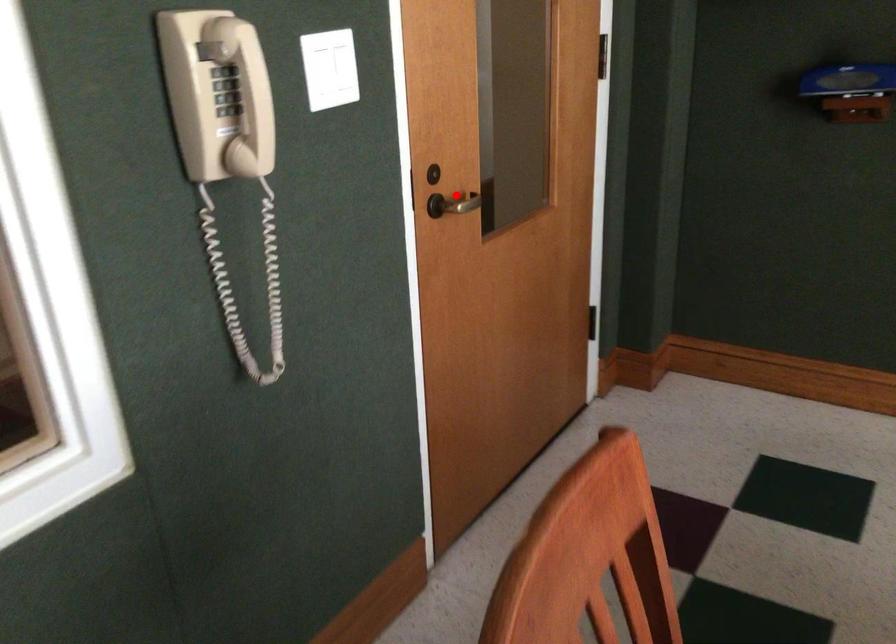
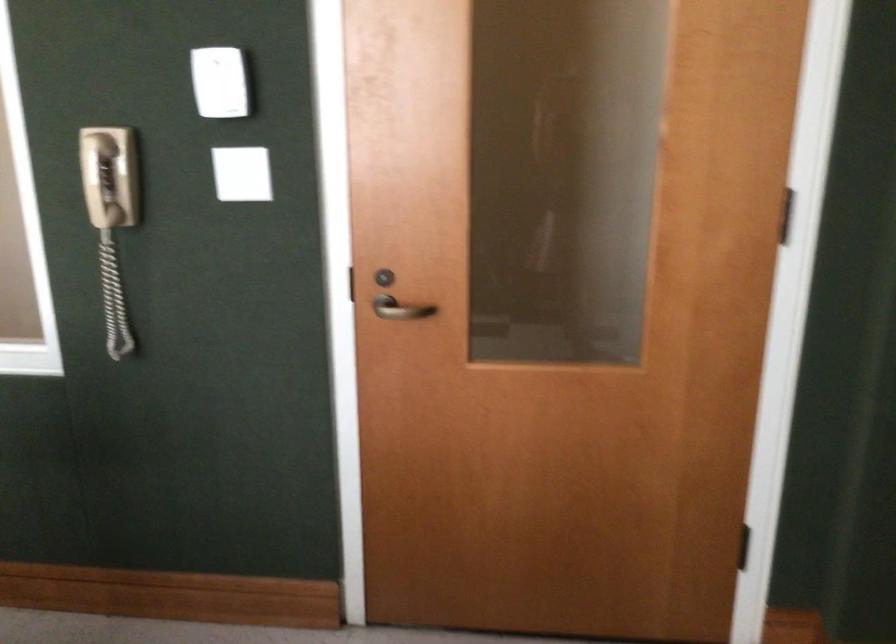
Locate, in the second image, the point that corresponds to the highlighted location in the first image.

(401, 308)